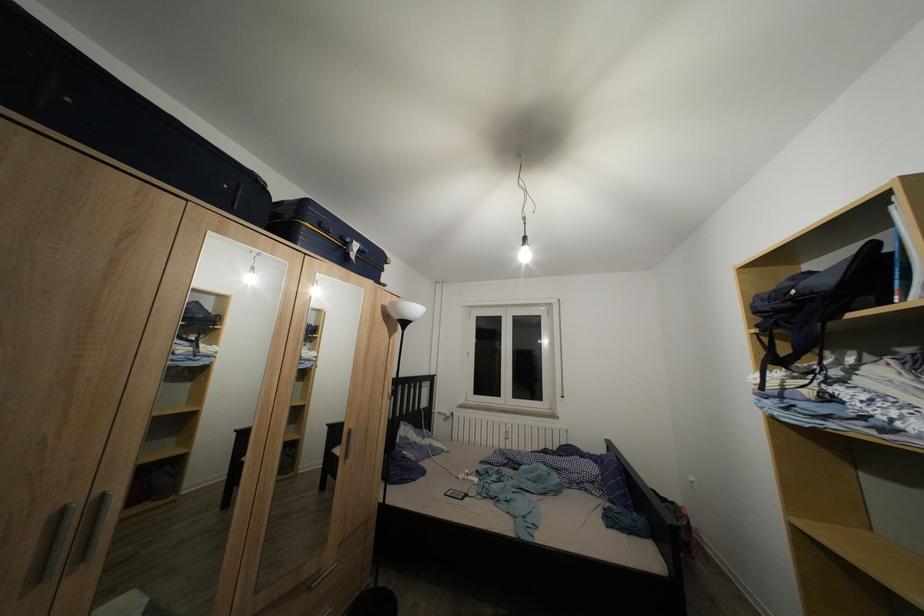
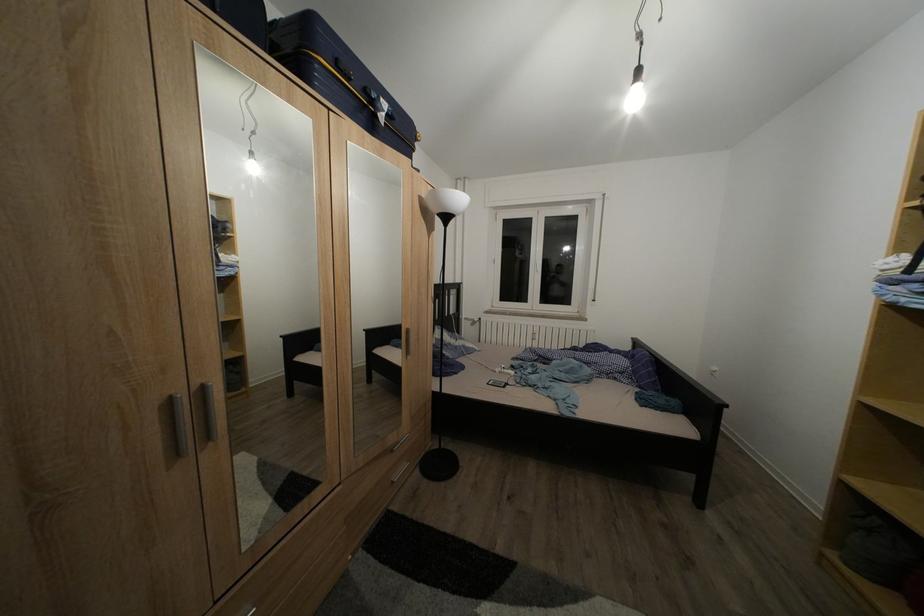
Question: How did the camera likely rotate?

Choices:
 (A) Left
 (B) Right
 (C) Up
 (D) Down

Answer: (D)